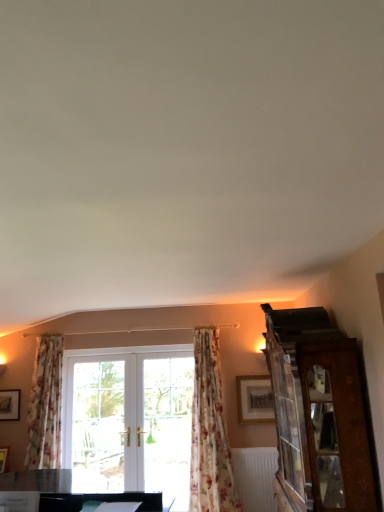
Describe the element at coordinates (45, 405) in the screenshot. Image resolution: width=384 pixels, height=512 pixels. I see `floral fabric curtain at left, which appears as the first curtain when viewed from the left` at that location.

This screenshot has width=384, height=512. What do you see at coordinates (210, 433) in the screenshot?
I see `floral fabric curtain at center, the first curtain from the right` at bounding box center [210, 433].

Identify the location of white textured radiator at lower center. (255, 477).

Where is `wooden picture frame at lower left, which is the 1th picture frame from left to right`? wooden picture frame at lower left, which is the 1th picture frame from left to right is located at coordinates (10, 405).

This screenshot has height=512, width=384. What do you see at coordinates (10, 405) in the screenshot?
I see `wooden picture frame at lower left, which is the second picture frame in front-to-back order` at bounding box center [10, 405].

Describe the element at coordinates (318, 414) in the screenshot. I see `wooden cabinet at right` at that location.

Locate an element on the screen. The height and width of the screenshot is (512, 384). clear glass door at center is located at coordinates (99, 422).

Identify the location of floral fabric curtain at left, which appears as the first curtain when viewed from the left. (45, 405).

Is clear glass door at center taller or shorter than matte gold picture frame at upper right, positioned as the 1th picture frame in right-to-left order?

In the image, clear glass door at center appears to be taller than matte gold picture frame at upper right, positioned as the 1th picture frame in right-to-left order.

Looking at this image, which is correct: clear glass door at center is inside matte gold picture frame at upper right, the first picture frame viewed from the front, or outside of it?

clear glass door at center is not inside matte gold picture frame at upper right, the first picture frame viewed from the front, it's outside.

Is clear glass door at center smaller than matte gold picture frame at upper right, positioned as the 1th picture frame in right-to-left order?

Actually, clear glass door at center might be larger than matte gold picture frame at upper right, positioned as the 1th picture frame in right-to-left order.

In the scene shown: Considering the positions of objects clear glass door at center and matte gold picture frame at upper right, which appears as the second picture frame when viewed from the left, in the image provided, who is more to the right, clear glass door at center or matte gold picture frame at upper right, which appears as the second picture frame when viewed from the left,?

From the viewer's perspective, matte gold picture frame at upper right, which appears as the second picture frame when viewed from the left, appears more on the right side.

Considering the sizes of objects white textured radiator at lower center and matte gold picture frame at upper right, which appears as the second picture frame when viewed from the left, in the image provided, who is shorter, white textured radiator at lower center or matte gold picture frame at upper right, which appears as the second picture frame when viewed from the left,?

Standing shorter between the two is matte gold picture frame at upper right, which appears as the second picture frame when viewed from the left.

Based on the photo, is matte gold picture frame at upper right, positioned as the 1th picture frame in right-to-left order, inside white textured radiator at lower center?

Actually, matte gold picture frame at upper right, positioned as the 1th picture frame in right-to-left order, is outside white textured radiator at lower center.

In terms of width, does white textured radiator at lower center look wider or thinner when compared to matte gold picture frame at upper right, which appears as the second picture frame when viewed from the left?

Considering their sizes, white textured radiator at lower center looks broader than matte gold picture frame at upper right, which appears as the second picture frame when viewed from the left.

Considering the relative positions of white textured radiator at lower center and matte gold picture frame at upper right, positioned as the 1th picture frame in right-to-left order, in the image provided, is white textured radiator at lower center to the left of matte gold picture frame at upper right, positioned as the 1th picture frame in right-to-left order, from the viewer's perspective?

Yes, white textured radiator at lower center is to the left of matte gold picture frame at upper right, positioned as the 1th picture frame in right-to-left order.

From the image's perspective, is floral fabric curtain at left, the second curtain in the right-to-left sequence, under clear glass door at center?

Actually, floral fabric curtain at left, the second curtain in the right-to-left sequence, appears above clear glass door at center in the image.

Who is smaller, floral fabric curtain at left, which appears as the first curtain when viewed from the left, or clear glass door at center?

clear glass door at center.

Considering the sizes of floral fabric curtain at left, the second curtain in the right-to-left sequence, and clear glass door at center in the image, is floral fabric curtain at left, the second curtain in the right-to-left sequence, taller or shorter than clear glass door at center?

floral fabric curtain at left, the second curtain in the right-to-left sequence, is shorter than clear glass door at center.

Which object is positioned more to the left, floral fabric curtain at left, the second curtain in the right-to-left sequence, or clear glass door at center?

From the viewer's perspective, floral fabric curtain at left, the second curtain in the right-to-left sequence, appears more on the left side.

Consider the image. How distant is floral fabric curtain at center, the first curtain from the right, from wooden cabinet at right?

1.89 meters.

Between floral fabric curtain at center, the first curtain from the right, and wooden cabinet at right, which one has smaller size?

Smaller between the two is floral fabric curtain at center, the first curtain from the right.

Between floral fabric curtain at center, placed as the second curtain when sorted from left to right, and wooden cabinet at right, which one is positioned in front?

Positioned in front is wooden cabinet at right.

From a real-world perspective, is floral fabric curtain at center, the first curtain from the right, on top of wooden cabinet at right?

No, from a real-world perspective, floral fabric curtain at center, the first curtain from the right, is not above wooden cabinet at right.

Based on their sizes in the image, would you say white textured radiator at lower center is bigger or smaller than floral fabric curtain at center, the first curtain from the right?

In the image, white textured radiator at lower center appears to be smaller than floral fabric curtain at center, the first curtain from the right.

Is white textured radiator at lower center not close to floral fabric curtain at center, placed as the second curtain when sorted from left to right?

white textured radiator at lower center is near floral fabric curtain at center, placed as the second curtain when sorted from left to right, not far away.

From a real-world perspective, is white textured radiator at lower center below floral fabric curtain at center, placed as the second curtain when sorted from left to right?

Yes, from a real-world perspective, white textured radiator at lower center is beneath floral fabric curtain at center, placed as the second curtain when sorted from left to right.

Consider the image. From a real-world perspective, which object stands above the other?

From a 3D spatial view, floral fabric curtain at left, the second curtain in the right-to-left sequence, is above.

Which object is thinner, floral fabric curtain at left, the second curtain in the right-to-left sequence, or clear glass door at center?

Thinner between the two is clear glass door at center.

From the image's perspective, which object appears higher, floral fabric curtain at left, the second curtain in the right-to-left sequence, or clear glass door at center?

From the image's view, floral fabric curtain at left, the second curtain in the right-to-left sequence, is above.

Looking at this image, do you think clear glass door at center is within floral fabric curtain at left, which appears as the first curtain when viewed from the left, or outside of it?

clear glass door at center is located beyond the bounds of floral fabric curtain at left, which appears as the first curtain when viewed from the left.

In the scene shown: Considering the sizes of objects clear glass door at center and floral fabric curtain at left, which appears as the first curtain when viewed from the left, in the image provided, who is taller, clear glass door at center or floral fabric curtain at left, which appears as the first curtain when viewed from the left,?

clear glass door at center.

From the image's perspective, is clear glass door at center positioned above or below floral fabric curtain at left, which appears as the first curtain when viewed from the left?

Clearly, from the image's perspective, clear glass door at center is below floral fabric curtain at left, which appears as the first curtain when viewed from the left.

In the image, there is a floral fabric curtain at left, the second curtain in the right-to-left sequence. Where is `screen door below it (from a real-world perspective)`? This screenshot has height=512, width=384. screen door below it (from a real-world perspective) is located at coordinates (99, 422).

What are the coordinates of `glass door lying behind the matte gold picture frame at upper right, the first picture frame viewed from the front` in the screenshot? It's located at (168, 426).

Image resolution: width=384 pixels, height=512 pixels. I want to click on picture frame on the right of the white textured radiator at lower center, so click(x=254, y=399).

When comparing their distances from matte gold picture frame at upper right, the first picture frame viewed from the front, does floral fabric curtain at left, which appears as the first curtain when viewed from the left, or floral fabric curtain at center, the first curtain from the right, seem further?

floral fabric curtain at left, which appears as the first curtain when viewed from the left, is further to matte gold picture frame at upper right, the first picture frame viewed from the front.

Estimate the real-world distances between objects in this image. Which object is further from wooden picture frame at lower left, the first picture frame viewed from the back, clear glass door at center or matte gold picture frame at upper right, the first picture frame viewed from the front?

Based on the image, matte gold picture frame at upper right, the first picture frame viewed from the front, appears to be further to wooden picture frame at lower left, the first picture frame viewed from the back.

Considering their positions, is matte gold picture frame at upper right, the first picture frame viewed from the front, positioned further to clear glass door at center than white textured radiator at lower center?

Based on the image, white textured radiator at lower center appears to be further to clear glass door at center.

Estimate the real-world distances between objects in this image. Which object is further from white textured radiator at lower center, matte gold picture frame at upper right, which appears as the second picture frame when viewed from the left, or clear glass door at center?

Based on the image, clear glass door at center appears to be further to white textured radiator at lower center.

When comparing their distances from wooden picture frame at lower left, which is the second picture frame in front-to-back order, does clear glass door at center or white textured radiator at lower center seem closer?

The object closer to wooden picture frame at lower left, which is the second picture frame in front-to-back order, is clear glass door at center.

Estimate the real-world distances between objects in this image. Which object is further from wooden cabinet at right, floral fabric curtain at left, which appears as the first curtain when viewed from the left, or floral fabric curtain at center, placed as the second curtain when sorted from left to right?

Among the two, floral fabric curtain at left, which appears as the first curtain when viewed from the left, is located further to wooden cabinet at right.

Based on their spatial positions, is floral fabric curtain at center, the first curtain from the right, or clear glass door at center further from floral fabric curtain at left, the second curtain in the right-to-left sequence?

Based on the image, floral fabric curtain at center, the first curtain from the right, appears to be further to floral fabric curtain at left, the second curtain in the right-to-left sequence.

Considering their positions, is floral fabric curtain at center, the first curtain from the right, positioned further to floral fabric curtain at left, the second curtain in the right-to-left sequence, than white textured radiator at lower center?

white textured radiator at lower center is further to floral fabric curtain at left, the second curtain in the right-to-left sequence.

Locate an element on the screen. The height and width of the screenshot is (512, 384). window between wooden picture frame at lower left, which is the second picture frame in front-to-back order, and wooden cabinet at right from left to right is located at coordinates (130, 419).

Locate an element on the screen. curtain between clear glass door at center and white textured radiator at lower center is located at coordinates (210, 433).

The height and width of the screenshot is (512, 384). Find the location of `glass door between floral fabric curtain at center, the first curtain from the right, and clear glass door at center in the front-back direction`. glass door between floral fabric curtain at center, the first curtain from the right, and clear glass door at center in the front-back direction is located at coordinates (168, 426).

Locate an element on the screen. The image size is (384, 512). screen door situated between wooden picture frame at lower left, which is the second picture frame in front-to-back order, and clear glass door at center from left to right is located at coordinates (99, 422).